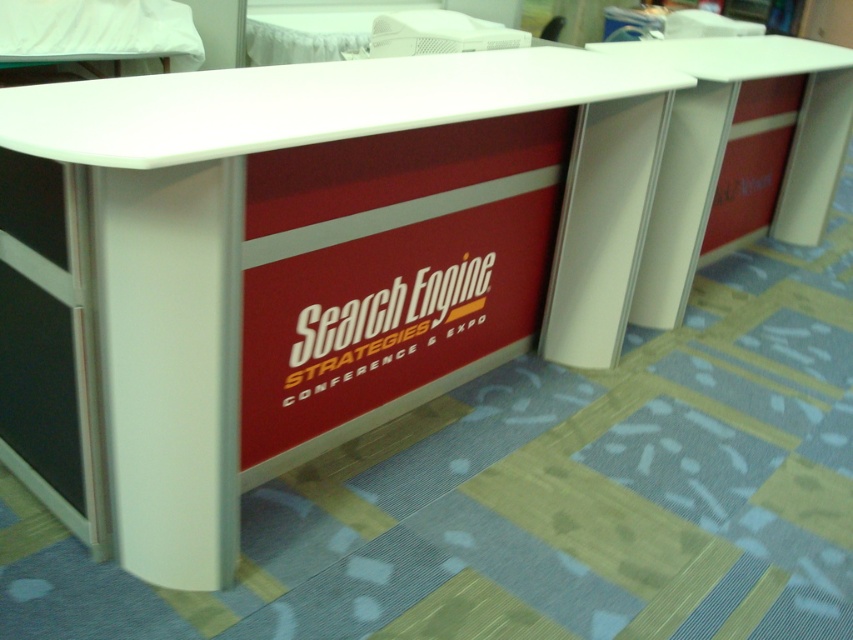
You are an attendee at the Search Engine Strategies Conference and you need to find the registration desk. You see the white glossy information desk at center and the white plastic table at right. According to the layout, which object is located below the other?

The white glossy information desk at center is positioned under the white plastic table at right, meaning the information desk is below the table in the layout.

You are standing at the point labeled point (231, 348). You want to walk to the registration desk located at the other end of the expo hall. The expo hall is 10 feet wide. Can you walk straight to the desk without crossing the center of the hall?

The distance between you and the registration desk is 5.06 feet, which is less than the 10 feet width of the expo hall. Therefore, you can walk straight to the desk without crossing the center of the hall.